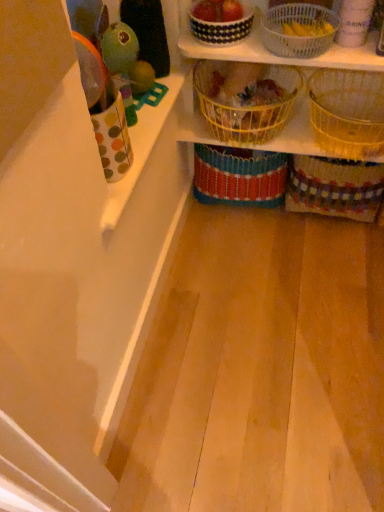
Question: From a real-world perspective, is yellow woven basket at center, which ranks as the fourth basket in right-to-left order, located higher than white woven basket at upper center, the 3th basket when ordered from right to left?

Choices:
 (A) yes
 (B) no

Answer: (B)

Question: Is the position of yellow woven basket at center, which ranks as the fourth basket in right-to-left order, more distant than that of white woven basket at upper center, the fourth basket positioned from the left?

Choices:
 (A) yes
 (B) no

Answer: (A)

Question: From the image's perspective, would you say yellow woven basket at center, the 3th basket when ordered from left to right, is positioned over white woven basket at upper center, the 3th basket when ordered from right to left?

Choices:
 (A) no
 (B) yes

Answer: (A)

Question: Is yellow woven basket at center, which ranks as the fourth basket in right-to-left order, bigger than white woven basket at upper center, the 3th basket when ordered from right to left?

Choices:
 (A) yes
 (B) no

Answer: (A)

Question: Is yellow woven basket at center, which ranks as the fourth basket in right-to-left order, next to white woven basket at upper center, the 3th basket when ordered from right to left?

Choices:
 (A) yes
 (B) no

Answer: (B)

Question: From a real-world perspective, relative to black and white checkered basket at upper center, the 1th basket viewed from the left, is woven yellow basket at upper right, the 2th basket when ordered from right to left, vertically above or below?

Choices:
 (A) below
 (B) above

Answer: (A)

Question: From the image's perspective, is woven yellow basket at upper right, the 2th basket when ordered from right to left, located above or below black and white checkered basket at upper center, the 1th basket viewed from the left?

Choices:
 (A) above
 (B) below

Answer: (B)

Question: Visually, is woven yellow basket at upper right, which is counted as the fifth basket, starting from the left, positioned to the left or to the right of black and white checkered basket at upper center, which ranks as the 6th basket in right-to-left order?

Choices:
 (A) right
 (B) left

Answer: (A)

Question: Is point (329, 138) positioned closer to the camera than point (218, 35)?

Choices:
 (A) farther
 (B) closer

Answer: (A)

Question: Looking at the image, does yellow wire basket at center, the fifth basket in the right-to-left sequence, seem bigger or smaller compared to yellow woven basket at center, which ranks as the fourth basket in right-to-left order?

Choices:
 (A) big
 (B) small

Answer: (B)

Question: Considering their positions, is yellow wire basket at center, the fifth basket in the right-to-left sequence, located in front of or behind yellow woven basket at center, which ranks as the fourth basket in right-to-left order?

Choices:
 (A) front
 (B) behind

Answer: (A)

Question: Based on their positions, is yellow wire basket at center, the fifth basket in the right-to-left sequence, located to the left or right of yellow woven basket at center, the 3th basket when ordered from left to right?

Choices:
 (A) right
 (B) left

Answer: (B)

Question: Is yellow wire basket at center, the 2th basket from the left, inside or outside of yellow woven basket at center, which ranks as the fourth basket in right-to-left order?

Choices:
 (A) outside
 (B) inside

Answer: (A)

Question: From the image's perspective, is woven yellow basket at upper right, the 2th basket when ordered from right to left, located above or below yellow woven basket at center, the 3th basket when ordered from left to right?

Choices:
 (A) above
 (B) below

Answer: (A)

Question: From a real-world perspective, relative to yellow woven basket at center, the 3th basket when ordered from left to right, is woven yellow basket at upper right, the 2th basket when ordered from right to left, vertically above or below?

Choices:
 (A) below
 (B) above

Answer: (B)